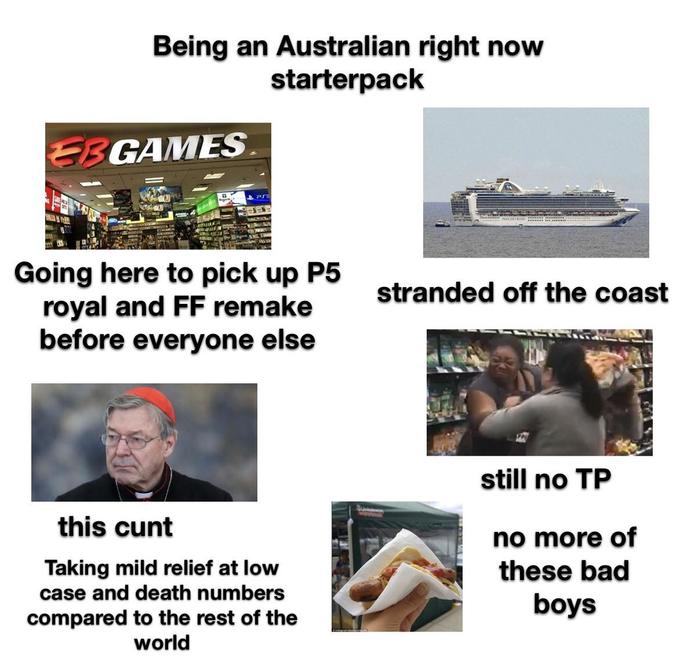
Locate an element on the screen. The height and width of the screenshot is (660, 680). ceiling is located at coordinates (184, 174).